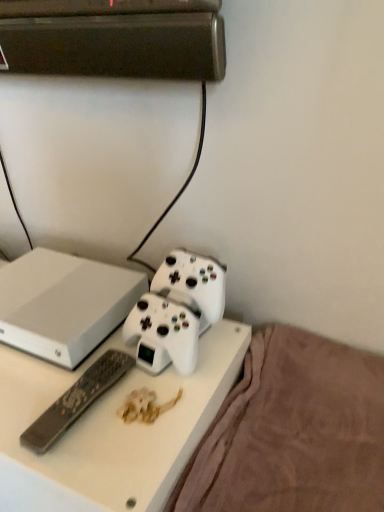
The height and width of the screenshot is (512, 384). Identify the location of free spot in front of white matte game controller at center. (147, 425).